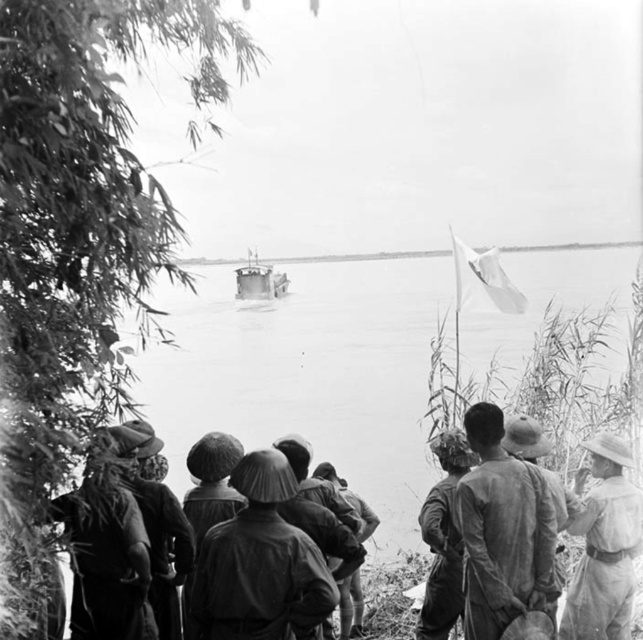
You are a photographer standing at the edge of the water and want to take a photo of the light brown fabric hat at right. Your camera has a maximum focus range of 20 feet. Will you be able to capture the hat clearly?

The light brown fabric hat at right and camera are 21.58 feet apart, which exceeds the camera maximum focus range of 20 feet. Therefore, you won not be able to capture the hat clearly.

You are a photographer analyzing this historical black and white image. You notice the matte brown helmet at center. Based on its position coordinates, can you determine if it is positioned closer to the top or bottom of the image?

The matte brown helmet at center is located at coordinates point (258, 563). Since the y coordinate 0.404 is closer to 0.5 than 0.0, it is near the center vertically. However, the x coordinate 0.881 is closer to 1.0, meaning it is positioned closer to the right edge of the image.

You are a photographer trying to capture a clear shot of the matte brown helmet at center and the metallic gray boat at center. Since you want both objects to appear equally prominent in the photo, which object should you zoom in on more?

The matte brown helmet at center has a smaller size compared to metallic gray boat at center. To make both appear equally prominent, you should zoom in more on the matte brown helmet at center to enlarge its image relative to the boat.